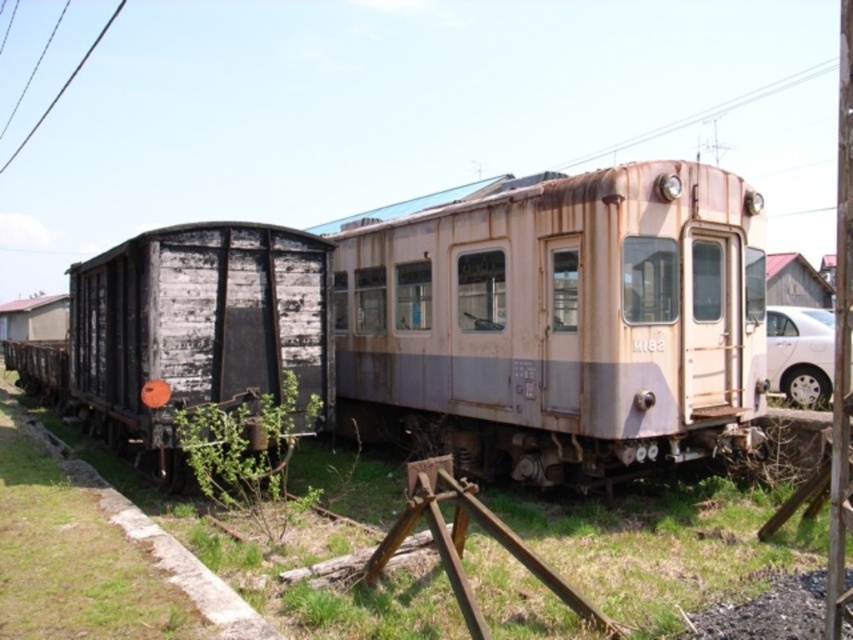
You are standing at the center of the railway track in the image. Looking towards the white matte car at right, which direction should you face? Choose from north, south, east, or west.

Since the white matte car at right is located at point coordinates 0.553 on the x and 0.939 on the y, which is in the lower right quadrant of the image, facing east would align you towards it from the center of the track.

You are standing in front of the two railway cars and want to determine which of the two points, point 1 at coordinates point (796, 387) or point 2 at coordinates point (102, 28), is closer to you. Based on the scene description, which point is nearer?

Point 1 at coordinates point (796, 387) is closer to the viewer than point 2 at coordinates point (102, 28).